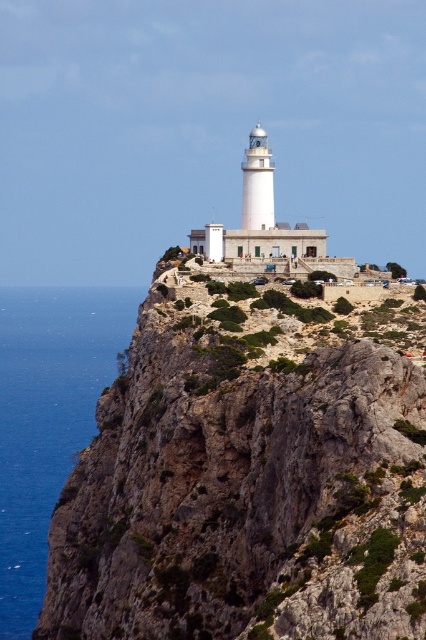
Question: Which of the following is the farthest from the observer?

Choices:
 (A) brown rough rock at upper center
 (B) blue liquid water at left

Answer: (B)

Question: Observing the image, what is the correct spatial positioning of brown rough rock at upper center in reference to blue liquid water at left?

Choices:
 (A) below
 (B) above

Answer: (B)

Question: Does brown rough rock at upper center have a greater width compared to blue liquid water at left?

Choices:
 (A) no
 (B) yes

Answer: (A)

Question: Which of the following is the closest to the observer?

Choices:
 (A) blue liquid water at left
 (B) brown rough rock at upper center

Answer: (B)

Question: Is brown rough rock at upper center closer to the viewer compared to blue liquid water at left?

Choices:
 (A) no
 (B) yes

Answer: (B)